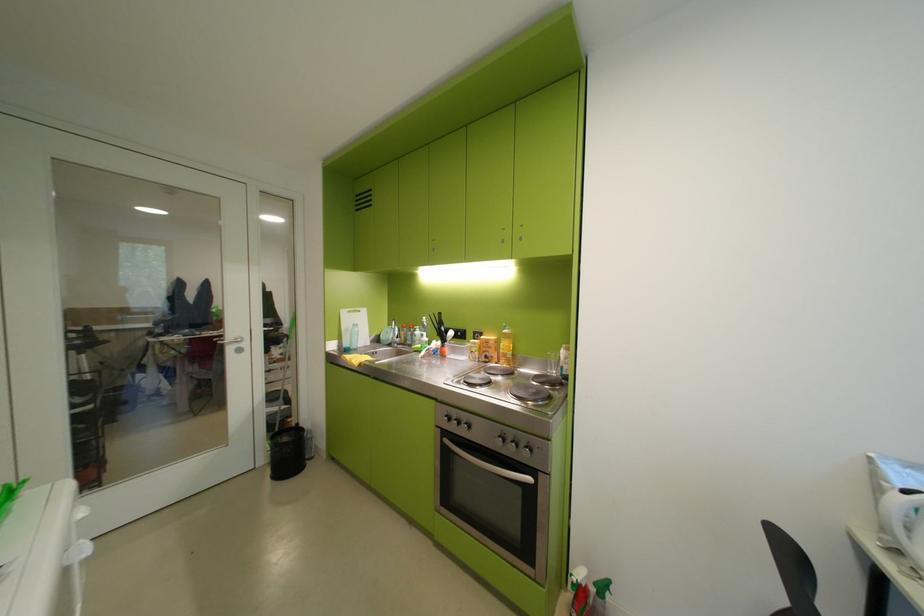
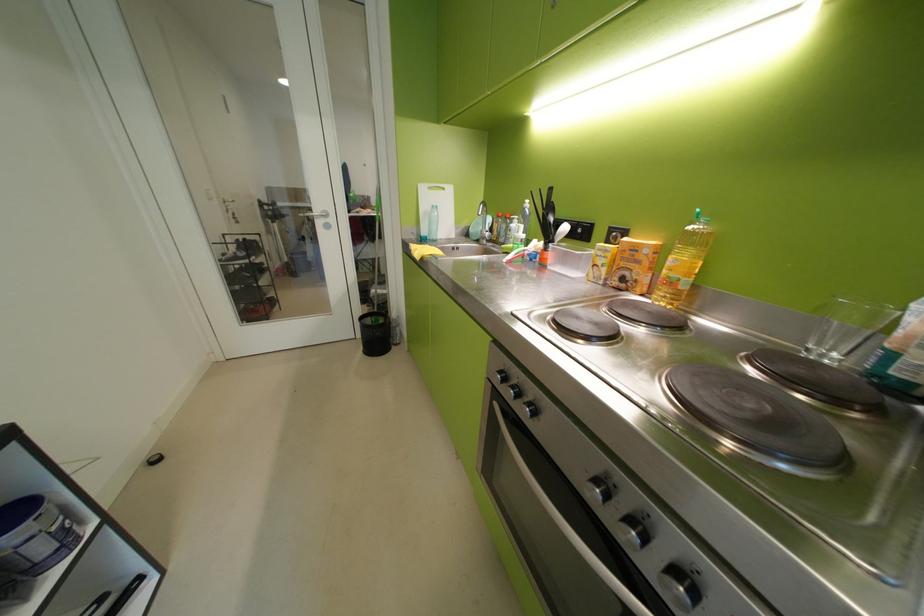
Question: I am providing you with two images of the same scene from different viewpoints. Please identify which objects are invisible in image2.

Choices:
 (A) clear glass cup
 (B) yellow oil bottle
 (C) white cutting board
 (D) none of these

Answer: (D)